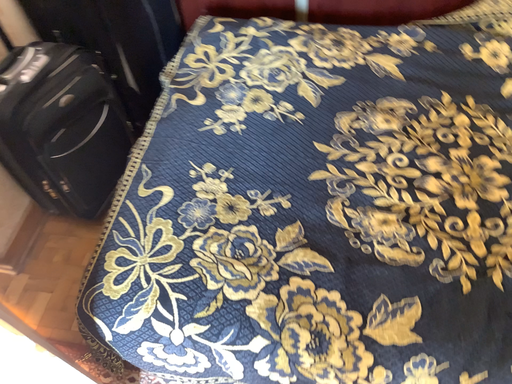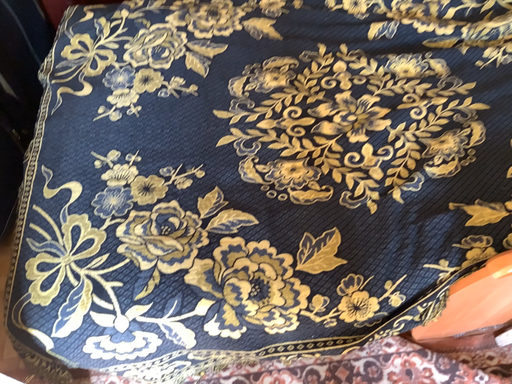
Question: How did the camera likely rotate when shooting the video?

Choices:
 (A) rotated left
 (B) rotated right

Answer: (B)